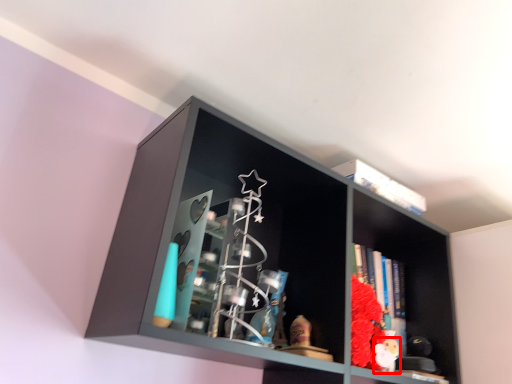
Question: Considering the relative positions of toy (annotated by the red box) and shelf in the image provided, where is toy (annotated by the red box) located with respect to the staircase?

Choices:
 (A) left
 (B) right

Answer: (B)